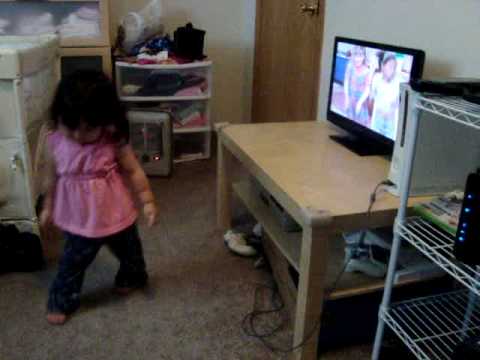
The width and height of the screenshot is (480, 360). In order to click on tv in this screenshot , I will do pyautogui.click(x=419, y=63).